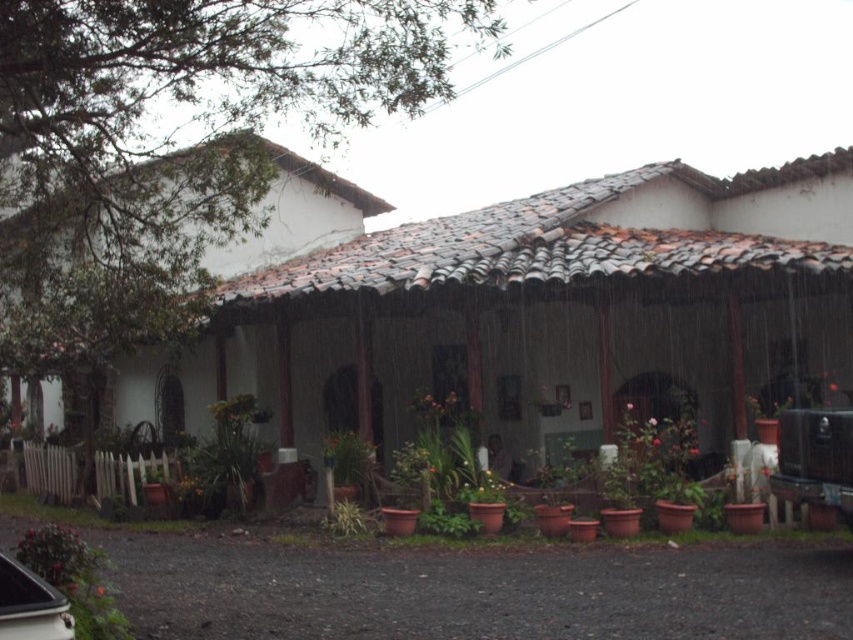
You are standing 3 meters away from the traditional house with a covered porch supported by wooden pillars. There is a point at coordinates point (x=79, y=618) in the image. Can you reach that point without moving closer than 3 meters to the house?

The distance of point (x=79, y=618) from viewer is 5.24 meters. Since you are already 3 meters away from the house, you need to move an additional 2.24 meters forward to reach the point, which would bring you closer than 3 meters. Therefore, you cannot reach the point without moving closer than 3 meters to the house.

You are standing on the porch of the traditional house and notice two plants. Which one is positioned higher up between the green matte plant at lower left and the green leafy plant at lower center?

The green matte plant at lower left is positioned higher up than the green leafy plant at lower center.

You are standing in the garden of the traditional house on a rainy day. You want to water the green leafy plant at lower left. Considering the distance between you and the plant, can you reach it with a standard garden hose that has a maximum reach of 50 feet?

The distance between you and the green leafy plant at lower left is 42.26 feet, which is within the 50 feet maximum reach of the standard garden hose. Therefore, you can water the green leafy plant at lower left using the hose.